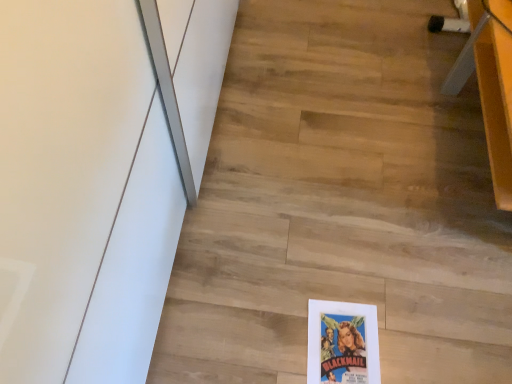
Find the location of a particular element. free space in front of wooden desk at upper right is located at coordinates (426, 288).